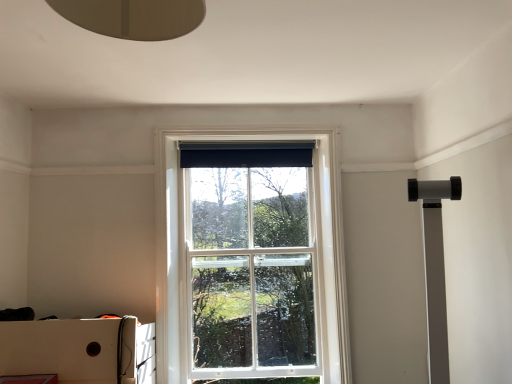
Question: Is black fabric curtain at upper center to the left or to the right of white glass window at center in the image?

Choices:
 (A) right
 (B) left

Answer: (A)

Question: Is black fabric curtain at upper center in front of or behind white glass window at center in the image?

Choices:
 (A) behind
 (B) front

Answer: (A)

Question: Which object is positioned closest to the black fabric curtain at upper center?

Choices:
 (A) white cardboard box at lower left
 (B) white glass window at center

Answer: (B)

Question: Estimate the real-world distances between objects in this image. Which object is farther from the black fabric curtain at upper center?

Choices:
 (A) white cardboard box at lower left
 (B) white glass window at center

Answer: (A)